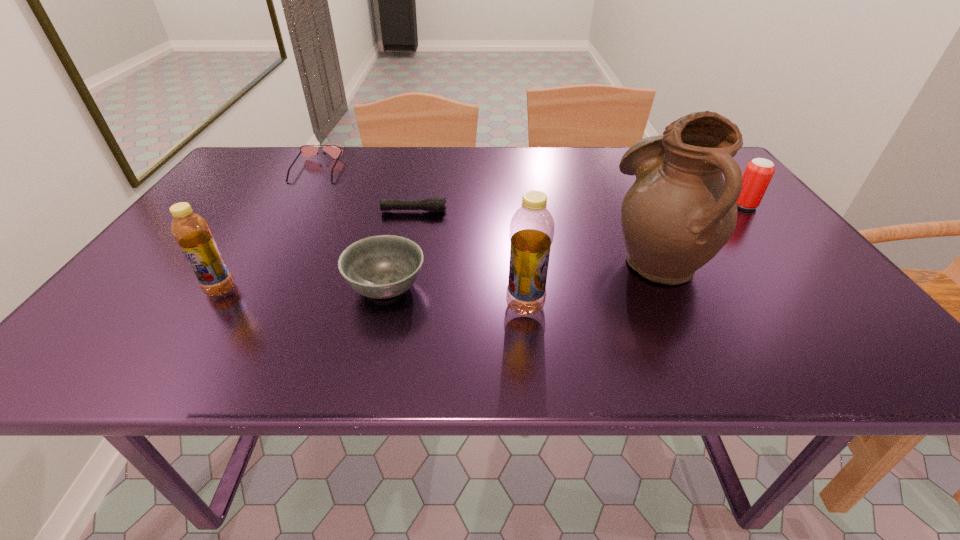
The height and width of the screenshot is (540, 960). What are the coordinates of `vacant space in between the fifth object from left to right and the pitcher` in the screenshot? It's located at (x=591, y=282).

This screenshot has width=960, height=540. I want to click on free space that is in between the farthest object and the third object from right to left, so click(x=421, y=238).

Identify the location of free space between the sunglasses and the third tallest object. (269, 230).

I want to click on vacant region between the shortest object and the sixth tallest object, so click(366, 191).

Locate an element on the screen. Image resolution: width=960 pixels, height=540 pixels. unoccupied position between the second tallest object and the sunglasses is located at coordinates (421, 238).

Where is `vacant area that lies between the farthest object and the second tallest object`? The width and height of the screenshot is (960, 540). vacant area that lies between the farthest object and the second tallest object is located at coordinates (421, 238).

The height and width of the screenshot is (540, 960). In order to click on free point between the sunglasses and the tallest object in this screenshot , I will do `click(488, 214)`.

Find the location of a particular element. The width and height of the screenshot is (960, 540). vacant area between the sixth tallest object and the third shortest object is located at coordinates (351, 228).

You are a GUI agent. You are given a task and a screenshot of the screen. Output one action in this format:
    pyautogui.click(x=<x>, y=<y>)
    Task: Click on the object that is the sixth closest to the right bottle
    
    Given the screenshot: What is the action you would take?
    pyautogui.click(x=305, y=150)

Locate an element on the screen. object that is the third closest one to the second shortest object is located at coordinates (191, 231).